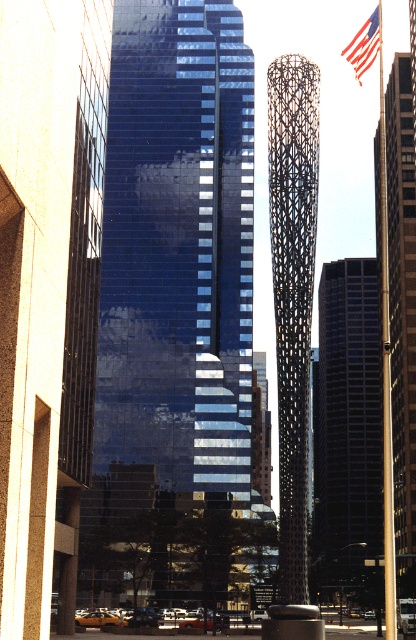
Question: Among these objects, which one is farthest from the camera?

Choices:
 (A) black textured sculpture at center
 (B) american flag at upper right

Answer: (A)

Question: Among these points, which one is nearest to the camera?

Choices:
 (A) (371, 44)
 (B) (324, 429)
 (C) (408, 288)
 (D) (307, 339)

Answer: (A)

Question: Is dark blue glass skyscraper at center bigger than polished glass tower at center?

Choices:
 (A) yes
 (B) no

Answer: (A)

Question: Based on their relative distances, which object is nearer to the dark blue glass skyscraper at center?

Choices:
 (A) black textured sculpture at center
 (B) polished glass tower at center

Answer: (B)

Question: Can you confirm if polished glass tower at center is wider than american flag at upper right?

Choices:
 (A) yes
 (B) no

Answer: (B)

Question: Does dark blue glass skyscraper at center come behind black textured sculpture at center?

Choices:
 (A) no
 (B) yes

Answer: (B)